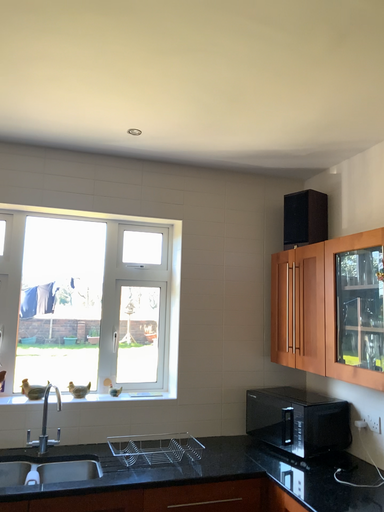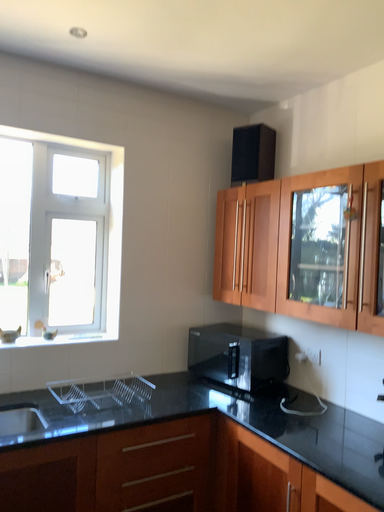
Question: Which way did the camera rotate in the video?

Choices:
 (A) rotated downward
 (B) rotated upward

Answer: (A)